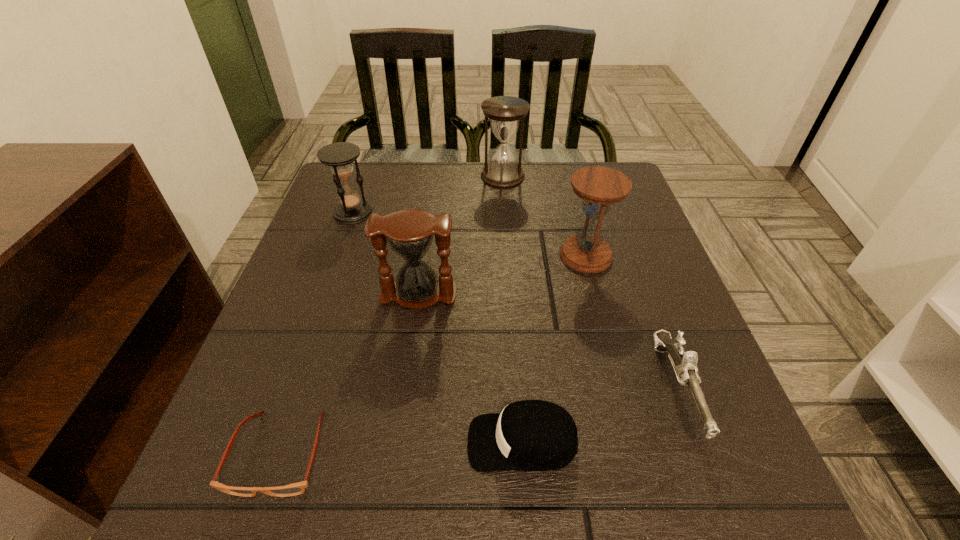
Find the location of a particular element. cap is located at coordinates (530, 435).

Where is `spectacles`? This screenshot has width=960, height=540. spectacles is located at coordinates (298, 488).

Image resolution: width=960 pixels, height=540 pixels. Identify the location of free space located 0.100m on the front of the second hourglass from right to left. (505, 210).

Locate an element on the screen. vacant space situated on the front of the rightmost hourglass is located at coordinates (637, 455).

This screenshot has width=960, height=540. What are the coordinates of `free space located on the front of the fourth farthest object` in the screenshot? It's located at (408, 373).

At what (x,y) coordinates should I click in order to perform the action: click on vacant space located on the back of the leftmost hourglass. Please return your answer as a coordinate pair (x, y). The width and height of the screenshot is (960, 540). Looking at the image, I should click on (366, 174).

This screenshot has height=540, width=960. I want to click on vacant space located aimed along the barrel of the rightmost object, so click(714, 495).

Find the location of a particular element. The height and width of the screenshot is (540, 960). free space located on the front-facing side of the cap is located at coordinates (421, 442).

The height and width of the screenshot is (540, 960). I want to click on free region located 0.230m on the front-facing side of the cap, so click(316, 442).

Identify the location of free space located on the front-facing side of the cap. (296, 442).